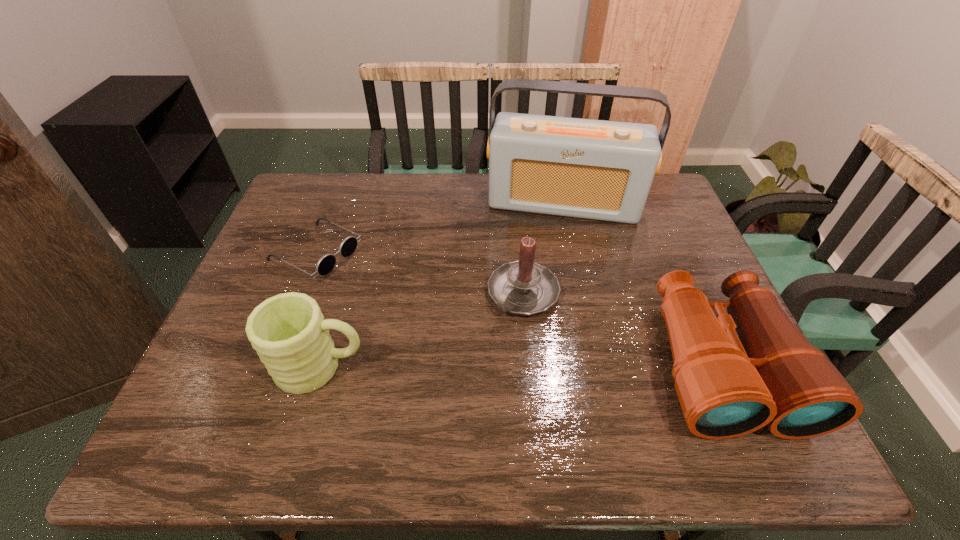
You are a GUI agent. You are given a task and a screenshot of the screen. Output one action in this format:
    pyautogui.click(x=<x>, y=<y>)
    Task: Click on the binoculars positioned at the right edge
    This screenshot has height=540, width=960.
    Given the screenshot: What is the action you would take?
    pyautogui.click(x=728, y=386)

Find the location of a particular element. radio receiver that is at the right edge is located at coordinates (602, 170).

At what (x,y) coordinates should I click in order to perform the action: click on object positioned at the near left corner. Please return your answer as a coordinate pair (x, y). Looking at the image, I should click on (288, 331).

The image size is (960, 540). What are the coordinates of `object present at the far right corner` in the screenshot? It's located at (602, 170).

Locate an element on the screen. This screenshot has height=540, width=960. object that is at the near right corner is located at coordinates (728, 386).

In the image, there is a desktop. Where is `free region at the far edge`? This screenshot has width=960, height=540. free region at the far edge is located at coordinates (414, 181).

Locate an element on the screen. The width and height of the screenshot is (960, 540). vacant space at the near edge of the desktop is located at coordinates (679, 406).

In the image, there is a desktop. Identify the location of free space at the left edge. (266, 286).

This screenshot has width=960, height=540. In the image, there is a desktop. Find the location of `free space at the right edge`. free space at the right edge is located at coordinates (683, 248).

In the image, there is a desktop. At what (x,y) coordinates should I click in order to perform the action: click on free space at the far left corner. Please return your answer as a coordinate pair (x, y). Looking at the image, I should click on (307, 175).